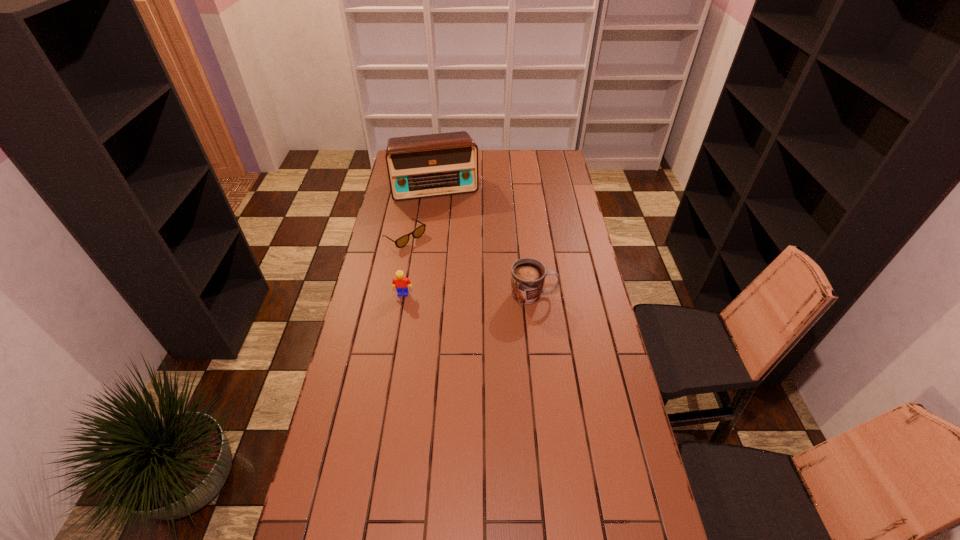
Where is `blank space that satisfies the following two spatial constraints: 1. on the front-facing side of the Lego; 2. on the side of the mug with the handle`? This screenshot has height=540, width=960. blank space that satisfies the following two spatial constraints: 1. on the front-facing side of the Lego; 2. on the side of the mug with the handle is located at coordinates (403, 295).